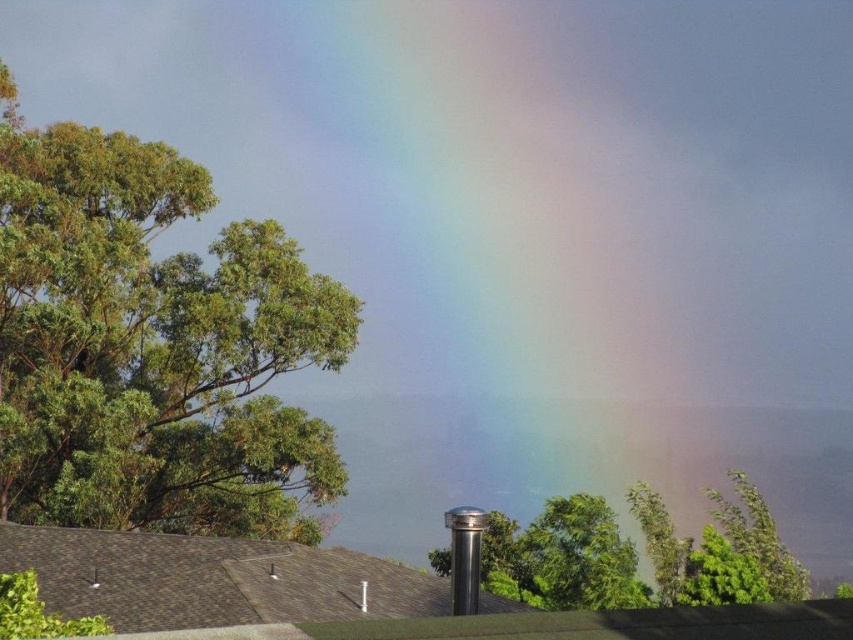
Between green leafy tree at upper left and green leafy tree at center, which one is positioned lower?

green leafy tree at center

Which of these two, green leafy tree at upper left or green leafy tree at center, stands taller?

green leafy tree at upper left is taller.

Describe the element at coordinates (152, 346) in the screenshot. This screenshot has height=640, width=853. I see `green leafy tree at upper left` at that location.

In order to click on green leafy tree at upper left in this screenshot , I will do `click(152, 346)`.